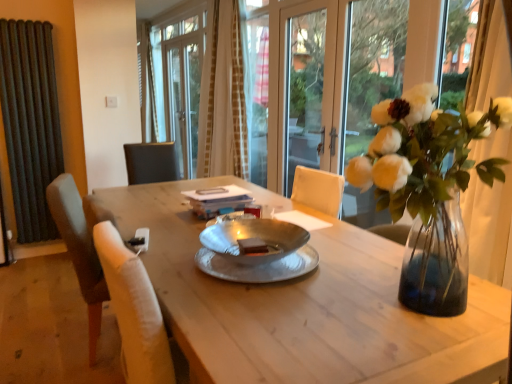
This screenshot has width=512, height=384. Find the location of `wooden table at center`. wooden table at center is located at coordinates (304, 304).

Locate an element on the screen. dark gray radiator at left is located at coordinates (30, 123).

Identify the location of transparent glass door at center. (308, 86).

Considering the sizes of objects clear glass vase at upper right and wooden table at center in the image provided, who is thinner, clear glass vase at upper right or wooden table at center?

Thinner between the two is clear glass vase at upper right.

From the image's perspective, which is below, clear glass vase at upper right or wooden table at center?

wooden table at center appears lower in the image.

Based on the photo, is clear glass vase at upper right directly adjacent to wooden table at center?

No, clear glass vase at upper right is not next to wooden table at center.

Can you confirm if clear glass vase at upper right is shorter than wooden table at center?

Correct, clear glass vase at upper right is not as tall as wooden table at center.

From the picture: Is dark gray radiator at left far away from transparent glass door at center?

Answer: Yes.

Which is correct: dark gray radiator at left is inside transparent glass door at center, or outside of it?

dark gray radiator at left is spatially situated outside transparent glass door at center.

Can you confirm if dark gray radiator at left is positioned to the right of transparent glass door at center?

Incorrect, dark gray radiator at left is not on the right side of transparent glass door at center.

Can you confirm if dark gray radiator at left is shorter than transparent glass door at center?

Incorrect, the height of dark gray radiator at left does not fall short of that of transparent glass door at center.

From a real-world perspective, between transparent glass door at center and beige textured curtain at upper center, who is vertically lower?

transparent glass door at center.

From the picture: Which is correct: transparent glass door at center is inside beige textured curtain at upper center, or outside of it?

The correct answer is: outside.

Is transparent glass door at center not near beige textured curtain at upper center?

No, there isn't a large distance between transparent glass door at center and beige textured curtain at upper center.

Identify the location of curtain that is on the left side of transparent glass door at center. (223, 97).

From the image's perspective, would you say dark gray radiator at left is shown under wooden table at center?

No, from the image's perspective, dark gray radiator at left is not below wooden table at center.

I want to click on desk below the dark gray radiator at left (from a real-world perspective), so click(304, 304).

Is dark gray radiator at left situated inside wooden table at center or outside?

dark gray radiator at left is not inside wooden table at center, it's outside.

Which point is more forward, (11,77) or (400,304)?

The point (400,304) is more forward.

Does beige textured curtain at upper center turn towards dark gray radiator at left?

Yes, beige textured curtain at upper center is oriented towards dark gray radiator at left.

Find the location of a particular element. The height and width of the screenshot is (384, 512). radiator in front of the beige textured curtain at upper center is located at coordinates (30, 123).

From the picture: Considering the sizes of beige textured curtain at upper center and dark gray radiator at left in the image, is beige textured curtain at upper center wider or thinner than dark gray radiator at left?

Clearly, beige textured curtain at upper center has more width compared to dark gray radiator at left.

From a real-world perspective, is beige textured curtain at upper center under dark gray radiator at left?

Incorrect, from a real-world perspective, beige textured curtain at upper center is higher than dark gray radiator at left.

Which of these two, beige textured curtain at upper center or transparent glass door at center, is wider?

beige textured curtain at upper center.

Which is in front, point (212, 51) or point (297, 91)?

Positioned in front is point (297, 91).

Looking at this image, is beige textured curtain at upper center not close to transparent glass door at center?

They are positioned close to each other.

Is beige textured curtain at upper center inside the boundaries of transparent glass door at center, or outside?

beige textured curtain at upper center exists outside the volume of transparent glass door at center.

Based on the photo, is clear glass vase at upper right oriented towards dark gray radiator at left?

Yes, clear glass vase at upper right is turned towards dark gray radiator at left.

Does point (436, 309) come behind point (34, 183)?

No.

Would you say clear glass vase at upper right is a long distance from dark gray radiator at left?

Yes, clear glass vase at upper right and dark gray radiator at left are located far from each other.

This screenshot has width=512, height=384. What are the coordinates of `desk that is below the clear glass vase at upper right (from the image's perspective)` in the screenshot? It's located at (304, 304).

Identify the location of screen door that appears above the dark gray radiator at left (from the image's perspective). This screenshot has width=512, height=384. (308, 86).

When comparing their distances from beige textured curtain at upper center, does clear glass vase at upper right or wooden table at center seem further?

Based on the image, clear glass vase at upper right appears to be further to beige textured curtain at upper center.

Looking at the image, which one is located further to wooden table at center, clear glass vase at upper right or dark gray radiator at left?

dark gray radiator at left is positioned further to the anchor wooden table at center.

From the picture: Which object lies nearer to the anchor point dark gray radiator at left, clear glass vase at upper right or transparent glass door at center?

transparent glass door at center is positioned closer to the anchor dark gray radiator at left.

When comparing their distances from clear glass vase at upper right, does wooden table at center or transparent glass door at center seem closer?

wooden table at center is closer to clear glass vase at upper right.

From the image, which object appears to be nearer to wooden table at center, transparent glass door at center or dark gray radiator at left?

The object closer to wooden table at center is transparent glass door at center.

From the image, which object appears to be nearer to beige textured curtain at upper center, dark gray radiator at left or wooden table at center?

Among the two, dark gray radiator at left is located nearer to beige textured curtain at upper center.

From the image, which object appears to be farther from beige textured curtain at upper center, wooden table at center or transparent glass door at center?

wooden table at center is further to beige textured curtain at upper center.

Which object lies nearer to the anchor point clear glass vase at upper right, transparent glass door at center or wooden table at center?

Among the two, wooden table at center is located nearer to clear glass vase at upper right.

This screenshot has width=512, height=384. I want to click on houseplant located between wooden table at center and transparent glass door at center in the depth direction, so click(x=428, y=182).

The width and height of the screenshot is (512, 384). Identify the location of screen door between wooden table at center and beige textured curtain at upper center in the front-back direction. (308, 86).

Find the location of `curtain between dark gray radiator at left and transparent glass door at center from left to right`. curtain between dark gray radiator at left and transparent glass door at center from left to right is located at coordinates click(223, 97).

The height and width of the screenshot is (384, 512). I want to click on screen door positioned between clear glass vase at upper right and beige textured curtain at upper center from near to far, so click(x=308, y=86).